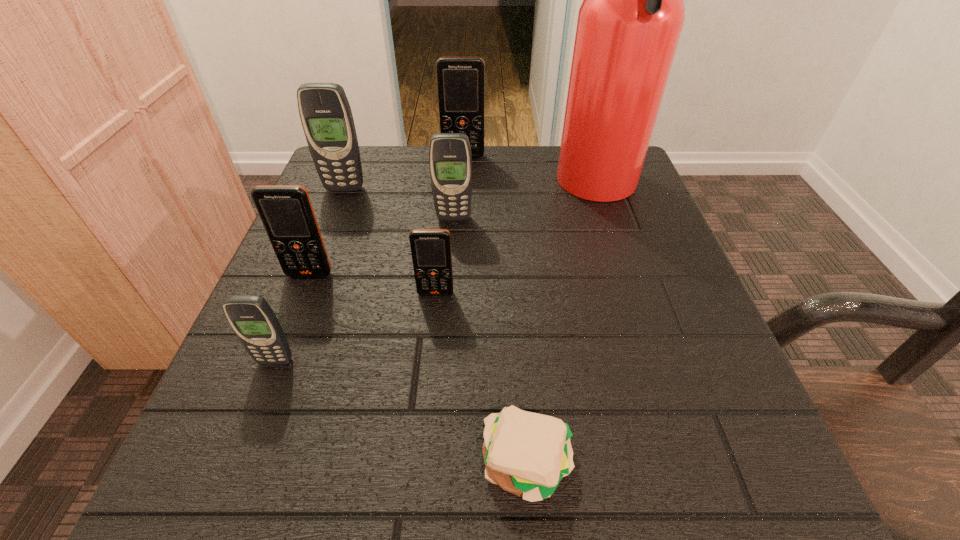
I want to click on the tallest object, so click(x=629, y=24).

The width and height of the screenshot is (960, 540). What are the coordinates of `fire extinguisher` in the screenshot? It's located at (629, 24).

The image size is (960, 540). Identify the location of the biggest orange cellular telephone. (460, 80).

Where is `the farthest orange cellular telephone`? This screenshot has height=540, width=960. the farthest orange cellular telephone is located at coordinates (460, 80).

This screenshot has width=960, height=540. Identify the location of the fifth nearest cellular telephone. (326, 116).

The height and width of the screenshot is (540, 960). I want to click on the biggest gray cellular telephone, so click(326, 116).

Locate an element on the screen. The image size is (960, 540). the second nearest gray cellular telephone is located at coordinates (450, 160).

Locate an element on the screen. The width and height of the screenshot is (960, 540). the rightmost gray cellular telephone is located at coordinates (450, 160).

This screenshot has height=540, width=960. I want to click on the second biggest orange cellular telephone, so click(286, 212).

At what (x,y) coordinates should I click in order to perform the action: click on the leftmost orange cellular telephone. Please return your answer as a coordinate pair (x, y). Looking at the image, I should click on (286, 212).